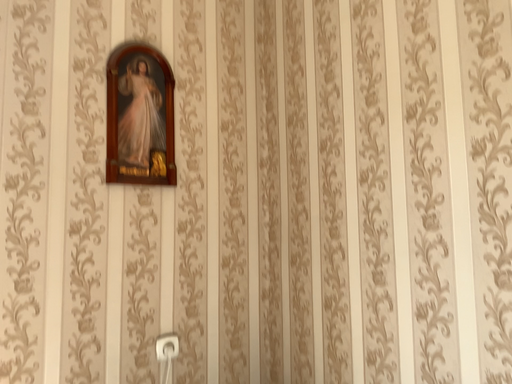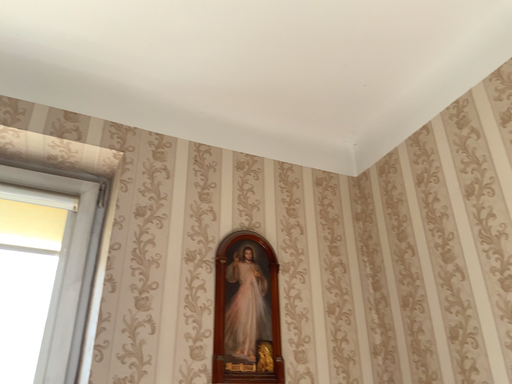
Question: How did the camera likely rotate when shooting the video?

Choices:
 (A) rotated upward
 (B) rotated downward

Answer: (A)